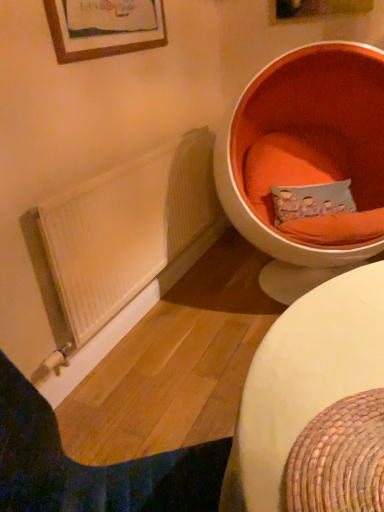
Measure the distance between white wood radiator at lower left and camera.

A distance of 23.90 inches exists between white wood radiator at lower left and camera.

The height and width of the screenshot is (512, 384). In order to click on white wood radiator at lower left in this screenshot , I will do `click(93, 466)`.

What do you see at coordinates (311, 201) in the screenshot?
I see `orange fabric pillow at upper right` at bounding box center [311, 201].

The image size is (384, 512). Identify the location of white wood radiator at lower left. (93, 466).

From their relative heights in the image, would you say orange fabric pillow at upper right is taller or shorter than white woven table at lower right?

Considering their sizes, orange fabric pillow at upper right has more height than white woven table at lower right.

Which is farther from the camera, (310, 200) or (261, 470)?

The point (310, 200) is more distant.

Who is smaller, orange fabric pillow at upper right or white woven table at lower right?

Smaller between the two is white woven table at lower right.

Considering the sizes of objects orange fabric at right and white wood radiator at lower left in the image provided, who is smaller, orange fabric at right or white wood radiator at lower left?

With smaller size is white wood radiator at lower left.

Consider the image. Are orange fabric at right and white wood radiator at lower left located far from each other?

Indeed, orange fabric at right is not near white wood radiator at lower left.

Is orange fabric at right facing away from white wood radiator at lower left?

No, orange fabric at right is not facing the opposite direction of white wood radiator at lower left.

Which of these two, orange fabric pillow at upper right or orange fabric at right, is wider?

With larger width is orange fabric at right.

Looking at this image, is orange fabric pillow at upper right oriented towards orange fabric at right?

Yes, orange fabric pillow at upper right is turned towards orange fabric at right.

From the picture: Is orange fabric pillow at upper right not near orange fabric at right?

No, there isn't a large distance between orange fabric pillow at upper right and orange fabric at right.

Considering the relative sizes of orange fabric pillow at upper right and orange fabric at right in the image provided, is orange fabric pillow at upper right bigger than orange fabric at right?

No.

From the image's perspective, which is above, orange fabric pillow at upper right or white wood radiator at lower left?

orange fabric pillow at upper right is shown above in the image.

Which of these two, orange fabric pillow at upper right or white wood radiator at lower left, is wider?

white wood radiator at lower left.

Locate an element on the screen. pillow that appears below the white wood radiator at lower left (from a real-world perspective) is located at coordinates (311, 201).

Which object is positioned more to the right, orange fabric at right or orange fabric pillow at upper right?

From the viewer's perspective, orange fabric pillow at upper right appears more on the right side.

From the image's perspective, which is below, orange fabric at right or orange fabric pillow at upper right?

From the image's view, orange fabric pillow at upper right is below.

In the scene shown: How much distance is there between orange fabric at right and orange fabric pillow at upper right?

10.77 inches.

Is orange fabric at right not inside orange fabric pillow at upper right?

Absolutely, orange fabric at right is external to orange fabric pillow at upper right.

Considering the positions of objects white woven table at lower right and orange fabric at right in the image provided, who is more to the right, white woven table at lower right or orange fabric at right?

orange fabric at right.

Who is taller, white woven table at lower right or orange fabric at right?

orange fabric at right is taller.

Would you say white woven table at lower right is outside orange fabric at right?

Indeed, white woven table at lower right is completely outside orange fabric at right.

In terms of width, does white woven table at lower right look wider or thinner when compared to orange fabric at right?

Clearly, white woven table at lower right has less width compared to orange fabric at right.

Do you think white wood radiator at lower left is within white woven table at lower right, or outside of it?

white wood radiator at lower left exists outside the volume of white woven table at lower right.

In terms of size, does white wood radiator at lower left appear bigger or smaller than white woven table at lower right?

white wood radiator at lower left is bigger than white woven table at lower right.

Can you confirm if white wood radiator at lower left is shorter than white woven table at lower right?

No, white wood radiator at lower left is not shorter than white woven table at lower right.

Which object is positioned more to the right, white wood radiator at lower left or white woven table at lower right?

white woven table at lower right is more to the right.

What are the coordinates of `table above the orange fabric pillow at upper right (from a real-world perspective)` in the screenshot? It's located at (309, 377).

Where is `furniture on the left of orange fabric at right`? The height and width of the screenshot is (512, 384). furniture on the left of orange fabric at right is located at coordinates (93, 466).

Looking at the image, which one is located closer to orange fabric at right, white woven table at lower right or white wood radiator at lower left?

white woven table at lower right is positioned closer to the anchor orange fabric at right.

Looking at the image, which one is located further to orange fabric at right, white wood radiator at lower left or white woven table at lower right?

white wood radiator at lower left is further to orange fabric at right.

Which object lies nearer to the anchor point orange fabric pillow at upper right, orange fabric at right or white woven table at lower right?

The object closer to orange fabric pillow at upper right is orange fabric at right.

When comparing their distances from white woven table at lower right, does white wood radiator at lower left or orange fabric at right seem closer?

white wood radiator at lower left is positioned closer to the anchor white woven table at lower right.

Estimate the real-world distances between objects in this image. Which object is closer to white wood radiator at lower left, orange fabric at right or orange fabric pillow at upper right?

orange fabric at right lies closer to white wood radiator at lower left than the other object.

In the scene shown: Estimate the real-world distances between objects in this image. Which object is further from white woven table at lower right, orange fabric at right or white wood radiator at lower left?

orange fabric at right is positioned further to the anchor white woven table at lower right.

Which object lies further to the anchor point orange fabric pillow at upper right, orange fabric at right or white wood radiator at lower left?

white wood radiator at lower left lies further to orange fabric pillow at upper right than the other object.

Estimate the real-world distances between objects in this image. Which object is closer to orange fabric at right, orange fabric pillow at upper right or white wood radiator at lower left?

Among the two, orange fabric pillow at upper right is located nearer to orange fabric at right.

I want to click on furniture between white woven table at lower right and orange fabric at right in the front-back direction, so click(93, 466).

Locate an element on the screen. furniture between white woven table at lower right and orange fabric pillow at upper right in the front-back direction is located at coordinates (93, 466).

You are a GUI agent. You are given a task and a screenshot of the screen. Output one action in this format:
    pyautogui.click(x=<x>, y=<y>)
    Task: Click on the toilet between white woven table at lower right and orange fabric pillow at upper right in the front-back direction
    This screenshot has width=384, height=512.
    Given the screenshot: What is the action you would take?
    pyautogui.click(x=307, y=162)

Where is `toilet between white wood radiator at lower left and orange fabric pillow at upper right along the z-axis`? This screenshot has height=512, width=384. toilet between white wood radiator at lower left and orange fabric pillow at upper right along the z-axis is located at coordinates point(307,162).